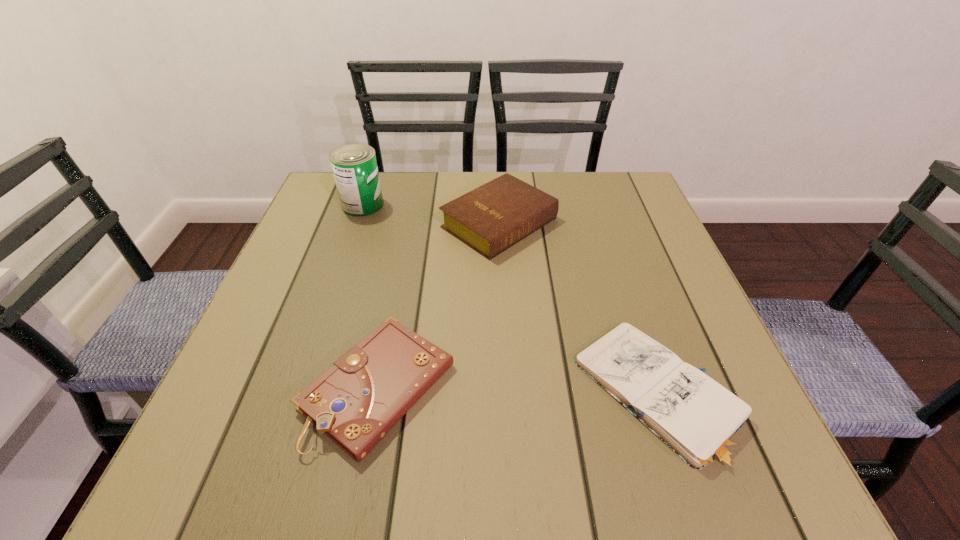
This screenshot has width=960, height=540. In the image, there is a desktop. Find the location of `vacant space at the left edge`. vacant space at the left edge is located at coordinates (341, 232).

At what (x,y) coordinates should I click in order to perform the action: click on free space at the right edge of the desktop. Please return your answer as a coordinate pair (x, y). Looking at the image, I should click on (690, 356).

The height and width of the screenshot is (540, 960). What are the coordinates of `vacant region at the far right corner of the desktop` in the screenshot? It's located at (608, 215).

Identify the location of vacant space at the near right corner of the desktop. The height and width of the screenshot is (540, 960). (756, 430).

What are the coordinates of `vacant point located between the can and the second tallest object` in the screenshot? It's located at (431, 214).

Where is `unoccupied position between the tallest object and the right notebook`? unoccupied position between the tallest object and the right notebook is located at coordinates (510, 300).

The width and height of the screenshot is (960, 540). I want to click on vacant point located between the shortest object and the taller notebook, so click(517, 390).

I want to click on vacant space that is in between the can and the taller notebook, so click(371, 295).

This screenshot has height=540, width=960. I want to click on free space between the Bible and the taller notebook, so click(439, 305).

The image size is (960, 540). What are the coordinates of `free spot between the second tallest object and the tallest object` in the screenshot? It's located at (431, 214).